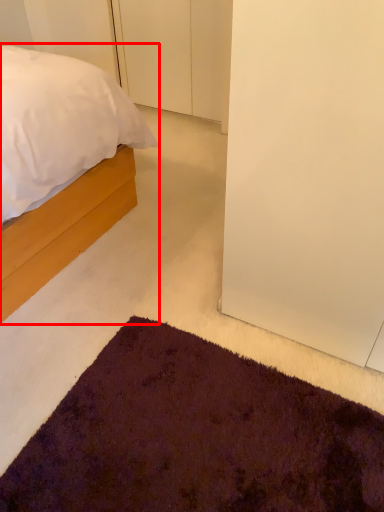
Question: Considering the relative positions of bed (annotated by the red box) and door in the image provided, where is bed (annotated by the red box) located with respect to the staircase?

Choices:
 (A) left
 (B) right

Answer: (A)